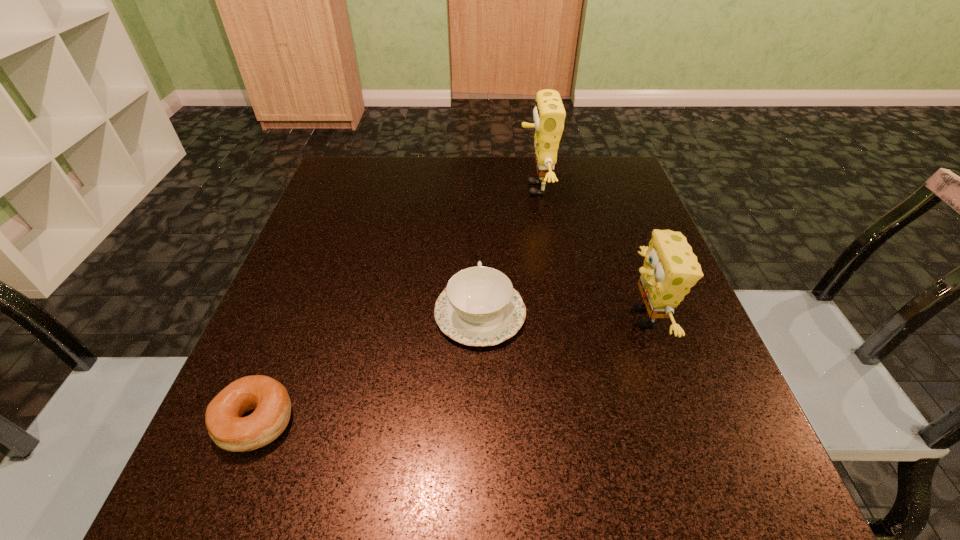
Choose which object is the third nearest neighbor to the chinaware. Please provide its 2D coordinates. Your answer should be formatted as a tuple, i.e. [(x, y)], where the tuple contains the x and y coordinates of a point satisfying the conditions above.

[(269, 399)]

Locate which object ranks in proximity to the left sponge. Please provide its 2D coordinates. Your answer should be formatted as a tuple, i.e. [(x, y)], where the tuple contains the x and y coordinates of a point satisfying the conditions above.

[(479, 307)]